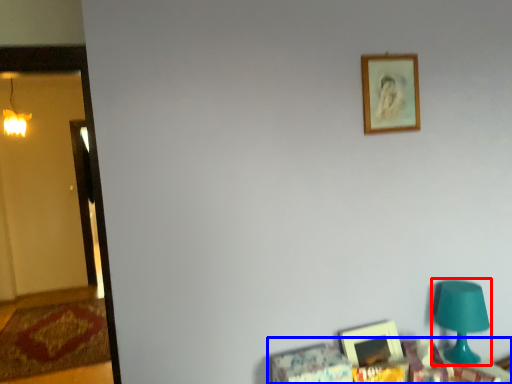
Question: Which of the following is the farthest to the observer, table lamp (highlighted by a red box) or furniture (highlighted by a blue box)?

Choices:
 (A) table lamp
 (B) furniture

Answer: (A)